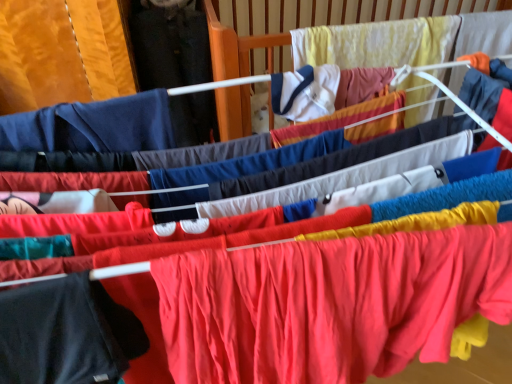
Question: Is matte red fabric at center, which is the 1th clothing from right to left, in front of or behind black matte t-shirt at lower left, positioned as the second clothing in right-to-left order, in the image?

Choices:
 (A) front
 (B) behind

Answer: (B)

Question: From the image's perspective, relative to black matte t-shirt at lower left, acting as the first clothing starting from the left, is matte red fabric at center, which is the 1th clothing from right to left, above or below?

Choices:
 (A) above
 (B) below

Answer: (A)

Question: Which of these objects is positioned farthest from the black matte t-shirt at lower left, positioned as the second clothing in right-to-left order?

Choices:
 (A) yellow fabric infant bed at upper center
 (B) matte red fabric at center, which is the 1th clothing from right to left

Answer: (A)

Question: Which object is the closest to the black matte t-shirt at lower left, positioned as the second clothing in right-to-left order?

Choices:
 (A) matte red fabric at center, arranged as the second clothing when viewed from the left
 (B) yellow fabric infant bed at upper center

Answer: (A)